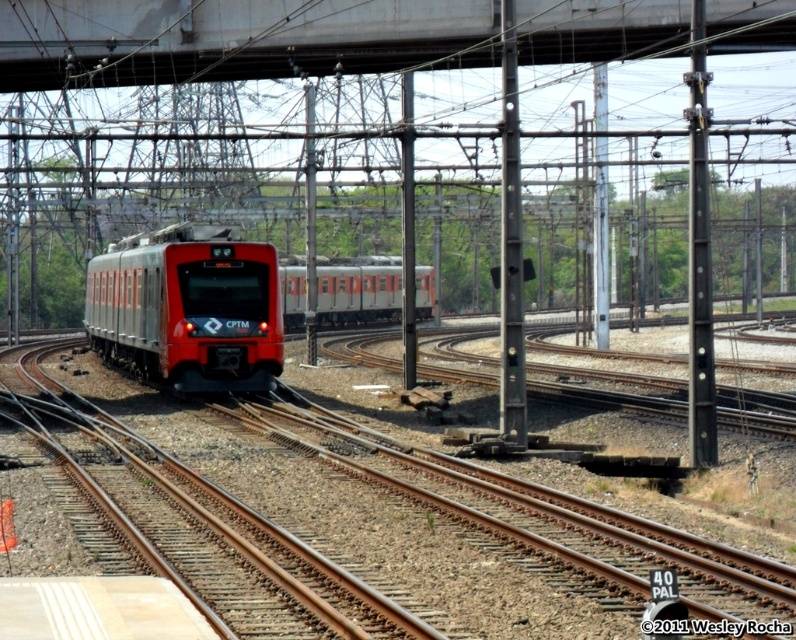
Question: Is matte red train at left bigger than matte silver train at center?

Choices:
 (A) no
 (B) yes

Answer: (A)

Question: Is metal train tracks at center below matte red train at left?

Choices:
 (A) yes
 (B) no

Answer: (A)

Question: Is metal train tracks at center to the left of matte red train at left from the viewer's perspective?

Choices:
 (A) no
 (B) yes

Answer: (A)

Question: Which is farther from the metal train tracks at center?

Choices:
 (A) metal at upper center
 (B) matte silver train at center

Answer: (B)

Question: Which object appears closest to the camera in this image?

Choices:
 (A) matte silver train at center
 (B) metal at upper center
 (C) matte red train at left

Answer: (B)

Question: Which point is farther to the camera?

Choices:
 (A) (176, 54)
 (B) (291, 308)

Answer: (B)